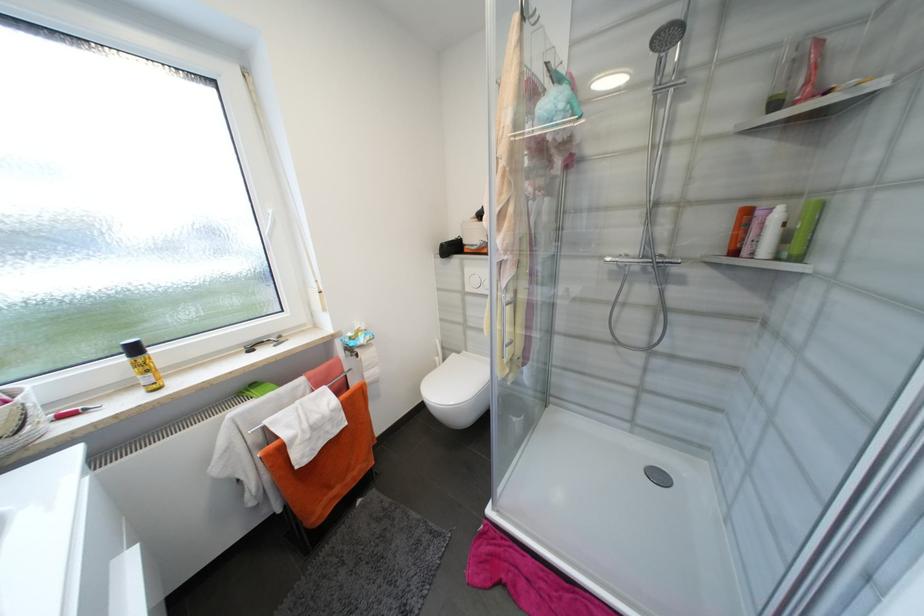
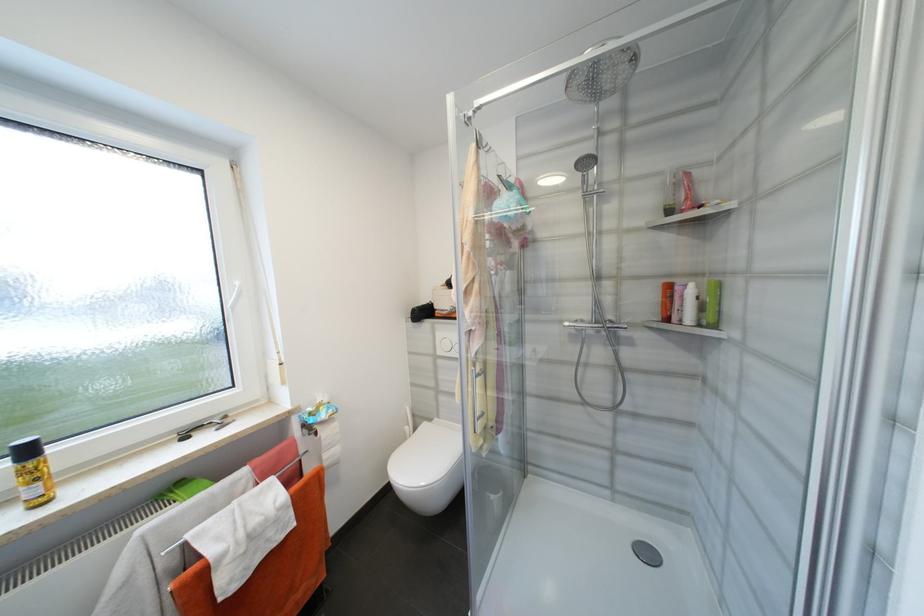
Find the pixel in the second image that matches (275,213) in the first image.

(242, 285)